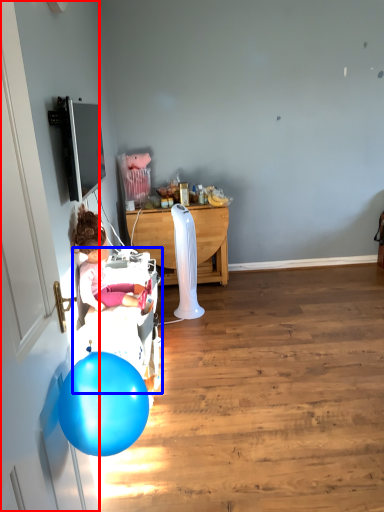
Question: Which object is closer to the camera taking this photo, door (highlighted by a red box) or baby carriage (highlighted by a blue box)?

Choices:
 (A) door
 (B) baby carriage

Answer: (A)